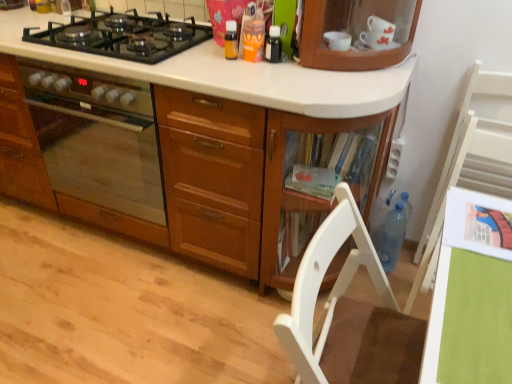
Question: Which direction should I rotate to face orange plastic cup at upper center, marked as the 2th kitchen appliance in a right-to-left arrangement, — up or down?

Choices:
 (A) down
 (B) up

Answer: (B)

Question: Considering the relative positions of black glass bottle at upper center, the first kitchen appliance in the right-to-left sequence, and blue translucent bottle at lower right in the image provided, is black glass bottle at upper center, the first kitchen appliance in the right-to-left sequence, to the left of blue translucent bottle at lower right from the viewer's perspective?

Choices:
 (A) no
 (B) yes

Answer: (B)

Question: Is the depth of black glass bottle at upper center, which ranks as the 3th kitchen appliance in left-to-right order, greater than that of blue translucent bottle at lower right?

Choices:
 (A) no
 (B) yes

Answer: (A)

Question: Would you say blue translucent bottle at lower right is part of black glass bottle at upper center, which ranks as the 3th kitchen appliance in left-to-right order,'s contents?

Choices:
 (A) no
 (B) yes

Answer: (A)

Question: Is black glass bottle at upper center, the first kitchen appliance in the right-to-left sequence, positioned before blue translucent bottle at lower right?

Choices:
 (A) yes
 (B) no

Answer: (A)

Question: Does black glass bottle at upper center, which ranks as the 3th kitchen appliance in left-to-right order, have a larger size compared to blue translucent bottle at lower right?

Choices:
 (A) no
 (B) yes

Answer: (A)

Question: Could you tell me if black glass bottle at upper center, the first kitchen appliance in the right-to-left sequence, is facing blue translucent bottle at lower right?

Choices:
 (A) yes
 (B) no

Answer: (B)

Question: Does black glass gas stove at upper left have a greater width compared to blue translucent bottle at lower right?

Choices:
 (A) yes
 (B) no

Answer: (A)

Question: Is black glass gas stove at upper left not near blue translucent bottle at lower right?

Choices:
 (A) yes
 (B) no

Answer: (A)

Question: Is blue translucent bottle at lower right a part of black glass gas stove at upper left?

Choices:
 (A) yes
 (B) no

Answer: (B)

Question: Would you say black glass gas stove at upper left is outside blue translucent bottle at lower right?

Choices:
 (A) no
 (B) yes

Answer: (B)

Question: Is black glass gas stove at upper left bigger than blue translucent bottle at lower right?

Choices:
 (A) yes
 (B) no

Answer: (A)

Question: Considering the relative sizes of black glass gas stove at upper left and blue translucent bottle at lower right in the image provided, is black glass gas stove at upper left shorter than blue translucent bottle at lower right?

Choices:
 (A) no
 (B) yes

Answer: (B)

Question: Is white wood chair at lower right, positioned as the second chair in back-to-front order, surrounding blue translucent bottle at lower right?

Choices:
 (A) no
 (B) yes

Answer: (A)